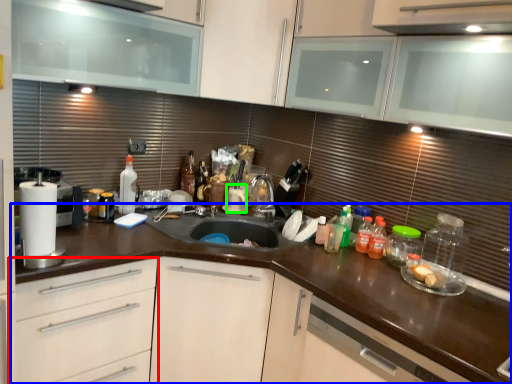
Question: Considering the real-world distances, which object is closest to drawer (highlighted by a red box)? countertop (highlighted by a blue box) or appliance (highlighted by a green box).

Choices:
 (A) countertop
 (B) appliance

Answer: (A)